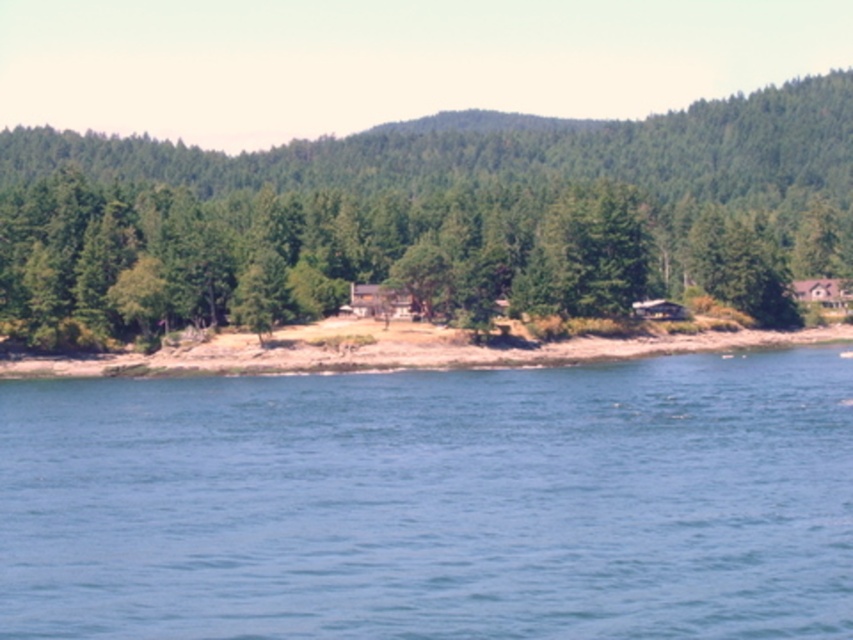
Question: Among these objects, which one is nearest to the camera?

Choices:
 (A) brown sandy shoreline at center
 (B) green matte tree at center
 (C) blue water at lower center

Answer: (C)

Question: Can you confirm if blue water at lower center is positioned to the left of brown sandy shoreline at center?

Choices:
 (A) yes
 (B) no

Answer: (A)

Question: Which of the following is the closest to the observer?

Choices:
 (A) green matte tree at center
 (B) blue water at lower center
 (C) brown sandy shoreline at center

Answer: (B)

Question: Estimate the real-world distances between objects in this image. Which object is farther from the brown sandy shoreline at center?

Choices:
 (A) green matte tree at center
 (B) blue water at lower center

Answer: (A)

Question: Does blue water at lower center have a smaller size compared to brown sandy shoreline at center?

Choices:
 (A) yes
 (B) no

Answer: (A)

Question: Can you confirm if blue water at lower center is smaller than brown sandy shoreline at center?

Choices:
 (A) no
 (B) yes

Answer: (B)